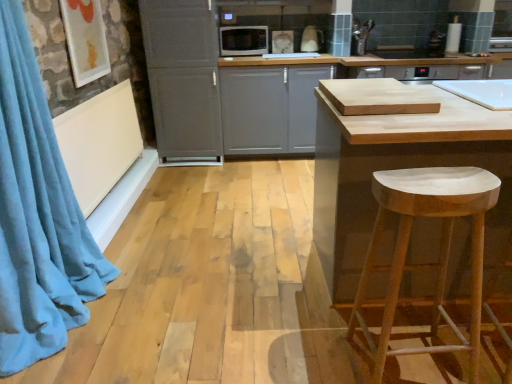
This screenshot has height=384, width=512. What are the coordinates of `empty space that is in between matte gray cabinet at center, the second cabinetry positioned from the right, and white matte stool at lower right` in the screenshot? It's located at (240, 211).